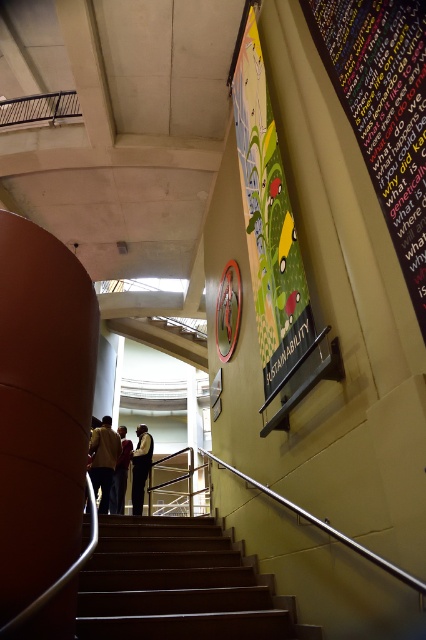
Which is in front, point (152, 566) or point (124, 460)?

Point (152, 566)

Is point (143, 531) farther from viewer compared to point (126, 460)?

That is False.

Which is behind, point (135, 582) or point (112, 492)?

The point (112, 492) is more distant.

Identify the location of wooden stairs at center. This screenshot has width=426, height=640. (178, 586).

Does yellow fabric jacket at center lie behind dark blue shirt at center?

No.

Does point (98, 451) come in front of point (120, 502)?

Yes, it is.

Locate an element on the screen. Image resolution: width=426 pixels, height=640 pixels. yellow fabric jacket at center is located at coordinates (103, 460).

Who is more forward, (408, 12) or (271, 291)?

Point (408, 12) is more forward.

Is multicolored fabric bulletin board at upper right smaller than vibrant glossy poster at upper center?

Yes.

The width and height of the screenshot is (426, 640). Find the location of `multicolored fabric bulletin board at upper right`. multicolored fabric bulletin board at upper right is located at coordinates (383, 109).

This screenshot has height=640, width=426. I want to click on multicolored fabric bulletin board at upper right, so click(x=383, y=109).